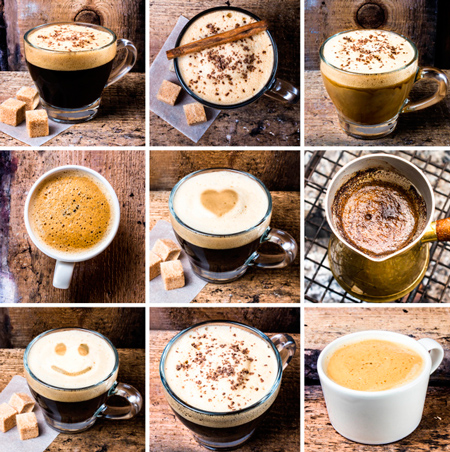
You are a GUI agent. You are given a task and a screenshot of the screen. Output one action in this format:
    pyautogui.click(x=<x>, y=<y>)
    Task: Click on the horizontal white line between photos in array
    The image size is (450, 452).
    Given the screenshot: What is the action you would take?
    pyautogui.click(x=68, y=147), pyautogui.click(x=212, y=148), pyautogui.click(x=369, y=147), pyautogui.click(x=65, y=303), pyautogui.click(x=214, y=304), pyautogui.click(x=370, y=306)